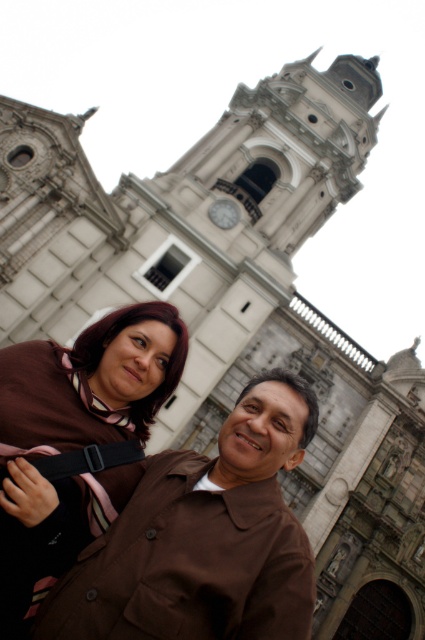
You are a photographer trying to capture a clear shot of both the brown matte jacket at center and the brown fabric at center in the image. Since the camera can only focus on one object at a time, which object should you choose to ensure the larger one is in focus?

The brown matte jacket at center has a larger size compared to brown fabric at center, so you should focus on the brown matte jacket at center to ensure the larger object is in focus.

You are standing in front of a historic building and see a brown matte jacket at center. If you want to take a photo of the jacket with the building in the background, will you need to zoom in or out your camera lens to ensure both the jacket and the building are in focus?

Since the brown matte jacket at center is 38.40 meters away from the viewer, you would need to adjust the focus so that both the jacket and the building are in focus. However, the distance between the jacket and the building isn

You are a photographer taking a picture of the historic building. You notice two brown items at the center of the scene. Which one is closer to you, the photographer, between the brown matte jacket at center and the brown fabric at center?

The brown matte jacket at center is closer to the viewer than the brown fabric at center.